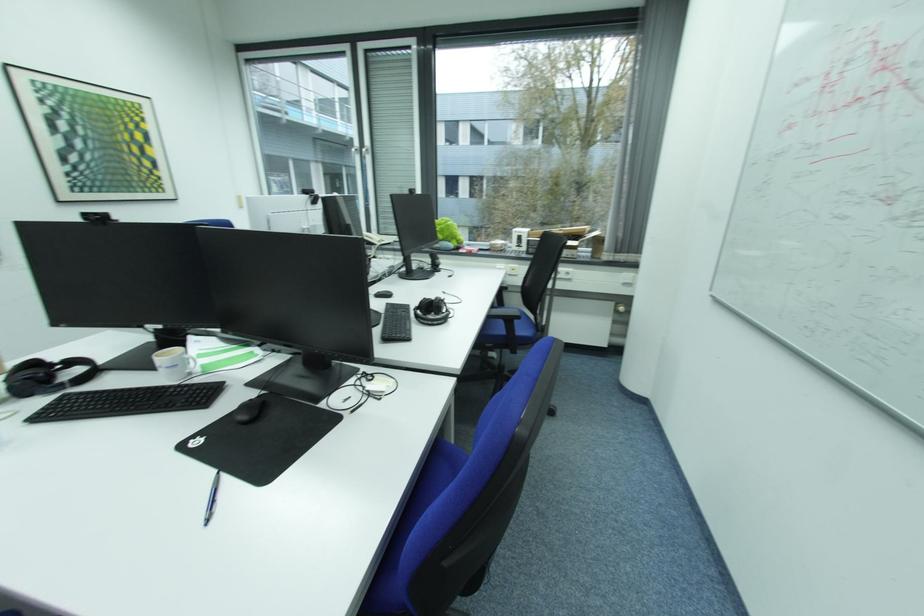
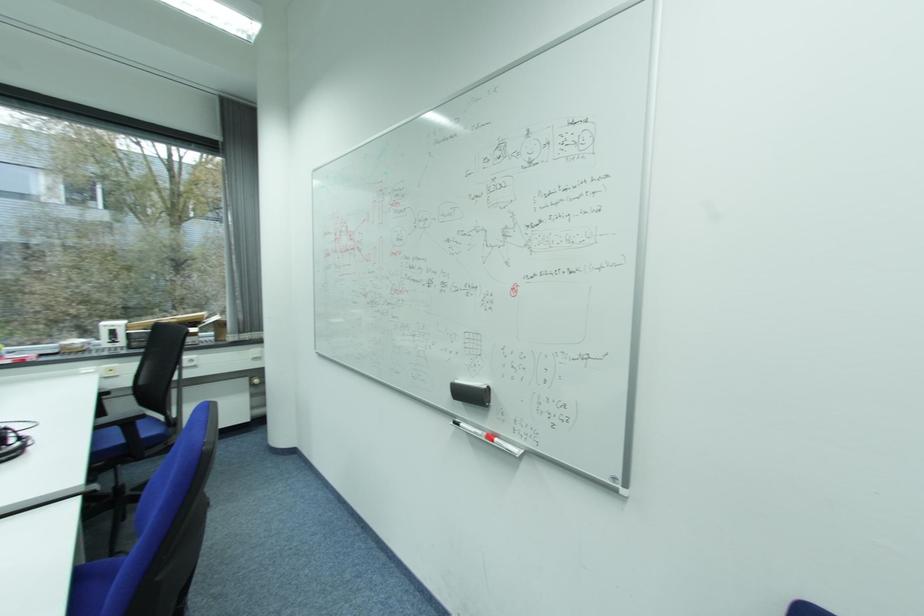
In the second image, find the point that corresponds to point (454, 310) in the first image.

(20, 442)